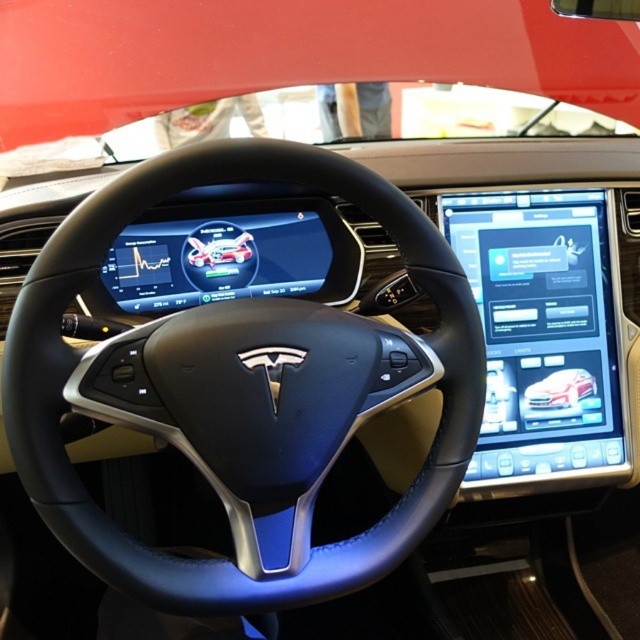
You are a passenger sitting in the back seat of the Tesla and want to reach the point at coordinates point (106, 410). If your arm can extend 80 centimeters, can you reach it?

The distance between point (106, 410) and the camera is 90.16 centimeters. Since your arm can only extend 80 centimeters, you cannot reach the point at point (106, 410).

You are a car designer reviewing the Tesla interior design. You need to determine if the black leather steering wheel at center will block the driver from seeing the white glossy car at center on the dashboard. Based on their sizes, can the steering wheel block the view?

The black leather steering wheel at center is much taller than the white glossy car at center, so it is likely that the steering wheel could block the driver from seeing the white glossy car at center on the dashboard.

You are sitting in the driver seat of the Tesla and want to reach both the point at (179, 387) and the point at (561, 371). Which point will be easier to reach because it is closer to you?

The point at (179, 387) is closer to the viewer than the point at (561, 371), so it will be easier to reach.